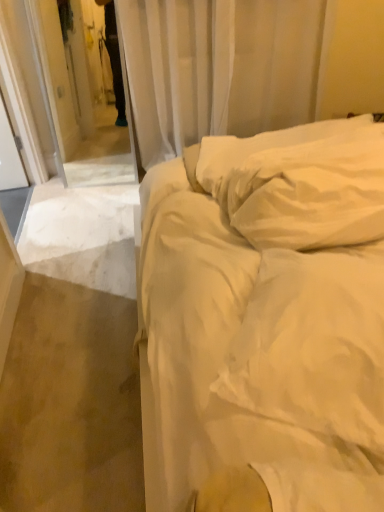
Locate an element on the screen. The height and width of the screenshot is (512, 384). white cotton bed at center is located at coordinates (270, 313).

Describe the element at coordinates (218, 68) in the screenshot. This screenshot has width=384, height=512. I see `white sheer curtain at upper center` at that location.

This screenshot has width=384, height=512. I want to click on white cotton bed at center, so (x=270, y=313).

Are white soft pillow at upper right and white sheer curtain at upper center far apart?

Yes, white soft pillow at upper right and white sheer curtain at upper center are located far from each other.

Consider the image. Which is more to the right, white soft pillow at upper right or white sheer curtain at upper center?

white soft pillow at upper right.

Considering the points (219, 146) and (226, 22), which point is in front, point (219, 146) or point (226, 22)?

The point (219, 146) is more forward.

From the picture: Considering the sizes of white soft pillow at upper right and white sheer curtain at upper center in the image, is white soft pillow at upper right bigger or smaller than white sheer curtain at upper center?

Considering their sizes, white soft pillow at upper right takes up less space than white sheer curtain at upper center.

Is white cotton bed at center outside of white soft pillow at upper right?

Answer: white cotton bed at center is positioned outside white soft pillow at upper right.

Is white cotton bed at center wider than white soft pillow at upper right?

Yes, white cotton bed at center is wider than white soft pillow at upper right.

Looking at this image, what's the angular difference between white cotton bed at center and white soft pillow at upper right's facing directions?

There is a 92-degree angle between the facing directions of white cotton bed at center and white soft pillow at upper right.

Is the surface of white cotton bed at center in direct contact with white soft pillow at upper right?

They are not placed beside each other.

Locate an element on the screen. This screenshot has width=384, height=512. pillow that appears above the white cotton bed at center (from the image's perspective) is located at coordinates (302, 185).

In the scene shown: Is white soft pillow at upper right not inside white cotton bed at center?

No, white soft pillow at upper right is inside or overlapping with white cotton bed at center.

Is white soft pillow at upper right facing away from white cotton bed at center?

No, white soft pillow at upper right's orientation is not away from white cotton bed at center.

Considering the sizes of objects white sheer curtain at upper center and white cotton bed at center in the image provided, who is bigger, white sheer curtain at upper center or white cotton bed at center?

white cotton bed at center is bigger.

From the image's perspective, is white sheer curtain at upper center over white cotton bed at center?

Yes, from the image's perspective, white sheer curtain at upper center is above white cotton bed at center.

Between white sheer curtain at upper center and white cotton bed at center, which one appears on the left side from the viewer's perspective?

white sheer curtain at upper center.

Which object is more forward, white sheer curtain at upper center or white cotton bed at center?

white cotton bed at center is in front.

Which of these two, white cotton bed at center or white sheer curtain at upper center, is wider?

Wider between the two is white cotton bed at center.

Can you confirm if white cotton bed at center is bigger than white sheer curtain at upper center?

Indeed, white cotton bed at center has a larger size compared to white sheer curtain at upper center.

Considering the points (268, 480) and (165, 109), which point is behind, point (268, 480) or point (165, 109)?

The point (165, 109) is farther from the camera.

From a real-world perspective, which object rests below the other?

From a 3D spatial view, white sheer curtain at upper center is below.

Locate an element on the screen. The width and height of the screenshot is (384, 512). curtain that is behind the white soft pillow at upper right is located at coordinates (218, 68).

From the image's perspective, which is above, white sheer curtain at upper center or white soft pillow at upper right?

From the image's view, white sheer curtain at upper center is above.

Considering the positions of objects white sheer curtain at upper center and white soft pillow at upper right in the image provided, who is behind, white sheer curtain at upper center or white soft pillow at upper right?

white sheer curtain at upper center is further away from the camera.

Where is `pillow on the right side of white sheer curtain at upper center`? Image resolution: width=384 pixels, height=512 pixels. pillow on the right side of white sheer curtain at upper center is located at coordinates click(x=302, y=185).

Identify the location of bed below the white soft pillow at upper right (from a real-world perspective). The width and height of the screenshot is (384, 512). (270, 313).

Consider the image. Which object lies nearer to the anchor point white sheer curtain at upper center, white cotton bed at center or white soft pillow at upper right?

Among the two, white soft pillow at upper right is located nearer to white sheer curtain at upper center.

Based on their spatial positions, is white sheer curtain at upper center or white cotton bed at center further from white soft pillow at upper right?

white sheer curtain at upper center lies further to white soft pillow at upper right than the other object.

From the image, which object appears to be farther from white soft pillow at upper right, white cotton bed at center or white sheer curtain at upper center?

white sheer curtain at upper center is positioned further to the anchor white soft pillow at upper right.

Looking at the image, which one is located closer to white cotton bed at center, white sheer curtain at upper center or white soft pillow at upper right?

The object closer to white cotton bed at center is white soft pillow at upper right.

Based on their spatial positions, is white soft pillow at upper right or white sheer curtain at upper center further from white cotton bed at center?

white sheer curtain at upper center.

Based on the photo, looking at the image, which one is located further to white sheer curtain at upper center, white soft pillow at upper right or white cotton bed at center?

white cotton bed at center is positioned further to the anchor white sheer curtain at upper center.

Locate an element on the screen. pillow between white cotton bed at center and white sheer curtain at upper center from front to back is located at coordinates (302, 185).